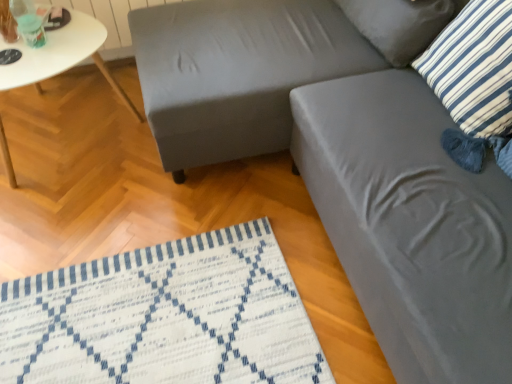
What do you see at coordinates (236, 72) in the screenshot? The width and height of the screenshot is (512, 384). I see `matte gray swivel chair at upper right, the first swivel chair positioned from the top` at bounding box center [236, 72].

The width and height of the screenshot is (512, 384). Find the location of `matte gray swivel chair at upper right, acting as the 2th swivel chair starting from the bottom`. matte gray swivel chair at upper right, acting as the 2th swivel chair starting from the bottom is located at coordinates (236, 72).

Identify the location of matte gray swivel chair at upper right, the first swivel chair positioned from the top. (236, 72).

Can you confirm if matte gray swivel chair at upper right, acting as the 2th swivel chair starting from the bottom, is shorter than blue and white striped pillow at upper right, acting as the first pillow starting from the front?

Incorrect, the height of matte gray swivel chair at upper right, acting as the 2th swivel chair starting from the bottom, does not fall short of that of blue and white striped pillow at upper right, acting as the first pillow starting from the front.

Is matte gray swivel chair at upper right, acting as the 2th swivel chair starting from the bottom, bigger than blue and white striped pillow at upper right, acting as the first pillow starting from the front?

Yes, matte gray swivel chair at upper right, acting as the 2th swivel chair starting from the bottom, is bigger than blue and white striped pillow at upper right, acting as the first pillow starting from the front.

Which of these two, matte gray swivel chair at upper right, acting as the 2th swivel chair starting from the bottom, or blue and white striped pillow at upper right, acting as the first pillow starting from the front, is thinner?

blue and white striped pillow at upper right, acting as the first pillow starting from the front.

How many degrees apart are the facing directions of matte gray swivel chair at upper right, acting as the 2th swivel chair starting from the bottom, and blue and white striped pillow at upper right, positioned as the second pillow in back-to-front order?

There is a 90-degree angle between the facing directions of matte gray swivel chair at upper right, acting as the 2th swivel chair starting from the bottom, and blue and white striped pillow at upper right, positioned as the second pillow in back-to-front order.

From the image's perspective, who appears lower, matte gray swivel chair at upper right, the first swivel chair positioned from the top, or matte gray swivel chair at center, acting as the second swivel chair starting from the top?

matte gray swivel chair at center, acting as the second swivel chair starting from the top, is shown below in the image.

From a real-world perspective, is matte gray swivel chair at upper right, acting as the 2th swivel chair starting from the bottom, over matte gray swivel chair at center, arranged as the 1th swivel chair when ordered from the bottom?

No, from a real-world perspective, matte gray swivel chair at upper right, acting as the 2th swivel chair starting from the bottom, is not above matte gray swivel chair at center, arranged as the 1th swivel chair when ordered from the bottom.

This screenshot has height=384, width=512. There is a matte gray swivel chair at upper right, the first swivel chair positioned from the top. In order to click on swivel chair above it (from a real-world perspective) in this screenshot , I will do [x=411, y=225].

Is matte gray swivel chair at upper right, acting as the 2th swivel chair starting from the bottom, taller or shorter than matte gray swivel chair at center, arranged as the 1th swivel chair when ordered from the bottom?

In the image, matte gray swivel chair at upper right, acting as the 2th swivel chair starting from the bottom, appears to be shorter than matte gray swivel chair at center, arranged as the 1th swivel chair when ordered from the bottom.

Is blue striped pillow at upper right, which is counted as the second pillow, starting from the front, beside white glossy table at left?

No, blue striped pillow at upper right, which is counted as the second pillow, starting from the front, is not in contact with white glossy table at left.

Locate an element on the screen. table below the blue striped pillow at upper right, which is counted as the second pillow, starting from the front (from the image's perspective) is located at coordinates (61, 57).

Looking at this image, looking at their sizes, would you say blue striped pillow at upper right, the 1th pillow viewed from the back, is wider or thinner than white glossy table at left?

Clearly, blue striped pillow at upper right, the 1th pillow viewed from the back, has less width compared to white glossy table at left.

Which of these two, blue striped pillow at upper right, which is counted as the second pillow, starting from the front, or white glossy table at left, is smaller?

blue striped pillow at upper right, which is counted as the second pillow, starting from the front.

Considering the relative positions of blue striped pillow at upper right, the 1th pillow viewed from the back, and blue and white striped pillow at upper right, positioned as the second pillow in back-to-front order, in the image provided, is blue striped pillow at upper right, the 1th pillow viewed from the back, to the left or to the right of blue and white striped pillow at upper right, positioned as the second pillow in back-to-front order,?

Clearly, blue striped pillow at upper right, the 1th pillow viewed from the back, is on the left of blue and white striped pillow at upper right, positioned as the second pillow in back-to-front order, in the image.

Considering the points (434, 26) and (511, 32), which point is in front, point (434, 26) or point (511, 32)?

The point (511, 32) is in front.

Which object is more forward, blue striped pillow at upper right, which is counted as the second pillow, starting from the front, or blue and white striped pillow at upper right, acting as the first pillow starting from the front?

blue and white striped pillow at upper right, acting as the first pillow starting from the front, is more forward.

Is blue striped pillow at upper right, which is counted as the second pillow, starting from the front, taller or shorter than blue and white striped pillow at upper right, acting as the first pillow starting from the front?

In the image, blue striped pillow at upper right, which is counted as the second pillow, starting from the front, appears to be shorter than blue and white striped pillow at upper right, acting as the first pillow starting from the front.

From a real-world perspective, relative to white glossy table at left, is blue and white striped pillow at upper right, acting as the first pillow starting from the front, vertically above or below?

blue and white striped pillow at upper right, acting as the first pillow starting from the front, is above white glossy table at left.

From the image's perspective, would you say blue and white striped pillow at upper right, acting as the first pillow starting from the front, is positioned over white glossy table at left?

No, from the image's perspective, blue and white striped pillow at upper right, acting as the first pillow starting from the front, is not above white glossy table at left.

Considering the relative sizes of blue and white striped pillow at upper right, positioned as the second pillow in back-to-front order, and white glossy table at left in the image provided, is blue and white striped pillow at upper right, positioned as the second pillow in back-to-front order, shorter than white glossy table at left?

Yes, blue and white striped pillow at upper right, positioned as the second pillow in back-to-front order, is shorter than white glossy table at left.

Is blue and white striped pillow at upper right, positioned as the second pillow in back-to-front order, turned away from white glossy table at left?

No, white glossy table at left is not at the back of blue and white striped pillow at upper right, positioned as the second pillow in back-to-front order.

From the image's perspective, is matte gray swivel chair at center, arranged as the 1th swivel chair when ordered from the bottom, under blue and white striped pillow at upper right, positioned as the second pillow in back-to-front order?

Indeed, from the image's perspective, matte gray swivel chair at center, arranged as the 1th swivel chair when ordered from the bottom, is shown beneath blue and white striped pillow at upper right, positioned as the second pillow in back-to-front order.

From the picture: From a real-world perspective, is matte gray swivel chair at center, acting as the second swivel chair starting from the top, physically above blue and white striped pillow at upper right, acting as the first pillow starting from the front?

No, from a real-world perspective, matte gray swivel chair at center, acting as the second swivel chair starting from the top, is not on top of blue and white striped pillow at upper right, acting as the first pillow starting from the front.

Can you tell me how much matte gray swivel chair at center, arranged as the 1th swivel chair when ordered from the bottom, and blue and white striped pillow at upper right, acting as the first pillow starting from the front, differ in facing direction?

The angular difference between matte gray swivel chair at center, arranged as the 1th swivel chair when ordered from the bottom, and blue and white striped pillow at upper right, acting as the first pillow starting from the front, is 0.306 degrees.

From the blue and white striped pillow at upper right, positioned as the second pillow in back-to-front order, count the 1st swivel chair to the left and point to it. Please provide its 2D coordinates.

[(411, 225)]

Is white glossy table at left oriented towards blue and white striped pillow at upper right, positioned as the second pillow in back-to-front order?

No, white glossy table at left is not facing towards blue and white striped pillow at upper right, positioned as the second pillow in back-to-front order.

From a real-world perspective, does white glossy table at left stand above blue and white striped pillow at upper right, positioned as the second pillow in back-to-front order?

No.

Which of these two, white glossy table at left or blue and white striped pillow at upper right, acting as the first pillow starting from the front, stands shorter?

blue and white striped pillow at upper right, acting as the first pillow starting from the front, is shorter.

In the scene shown: Is white glossy table at left in contact with blue and white striped pillow at upper right, positioned as the second pillow in back-to-front order?

No, white glossy table at left is not making contact with blue and white striped pillow at upper right, positioned as the second pillow in back-to-front order.

Where is `the 2nd pillow to the right when counting from the matte gray swivel chair at upper right, the first swivel chair positioned from the top`? Image resolution: width=512 pixels, height=384 pixels. the 2nd pillow to the right when counting from the matte gray swivel chair at upper right, the first swivel chair positioned from the top is located at coordinates (474, 68).

Find the location of a particular element. The image size is (512, 384). swivel chair above the matte gray swivel chair at upper right, the first swivel chair positioned from the top (from a real-world perspective) is located at coordinates (411, 225).

Which object lies nearer to the anchor point matte gray swivel chair at upper right, the first swivel chair positioned from the top, matte gray swivel chair at center, acting as the second swivel chair starting from the top, or blue striped pillow at upper right, which is counted as the second pillow, starting from the front?

The object closer to matte gray swivel chair at upper right, the first swivel chair positioned from the top, is blue striped pillow at upper right, which is counted as the second pillow, starting from the front.

Which object lies further to the anchor point matte gray swivel chair at center, acting as the second swivel chair starting from the top, white glossy table at left or blue and white striped pillow at upper right, acting as the first pillow starting from the front?

The object further to matte gray swivel chair at center, acting as the second swivel chair starting from the top, is white glossy table at left.

Estimate the real-world distances between objects in this image. Which object is closer to white glossy table at left, blue and white striped pillow at upper right, acting as the first pillow starting from the front, or matte gray swivel chair at center, arranged as the 1th swivel chair when ordered from the bottom?

matte gray swivel chair at center, arranged as the 1th swivel chair when ordered from the bottom, is closer to white glossy table at left.

When comparing their distances from blue striped pillow at upper right, which is counted as the second pillow, starting from the front, does matte gray swivel chair at upper right, the first swivel chair positioned from the top, or matte gray swivel chair at center, arranged as the 1th swivel chair when ordered from the bottom, seem closer?

matte gray swivel chair at upper right, the first swivel chair positioned from the top, is positioned closer to the anchor blue striped pillow at upper right, which is counted as the second pillow, starting from the front.

Which object lies further to the anchor point matte gray swivel chair at center, arranged as the 1th swivel chair when ordered from the bottom, white glossy table at left or matte gray swivel chair at upper right, acting as the 2th swivel chair starting from the bottom?

white glossy table at left.

Considering their positions, is matte gray swivel chair at center, arranged as the 1th swivel chair when ordered from the bottom, positioned further to blue striped pillow at upper right, which is counted as the second pillow, starting from the front, than matte gray swivel chair at upper right, the first swivel chair positioned from the top?

matte gray swivel chair at center, arranged as the 1th swivel chair when ordered from the bottom.

When comparing their distances from white glossy table at left, does matte gray swivel chair at center, acting as the second swivel chair starting from the top, or blue and white striped pillow at upper right, acting as the first pillow starting from the front, seem closer?

Among the two, matte gray swivel chair at center, acting as the second swivel chair starting from the top, is located nearer to white glossy table at left.

When comparing their distances from matte gray swivel chair at center, acting as the second swivel chair starting from the top, does white glossy table at left or blue striped pillow at upper right, which is counted as the second pillow, starting from the front, seem closer?

Among the two, blue striped pillow at upper right, which is counted as the second pillow, starting from the front, is located nearer to matte gray swivel chair at center, acting as the second swivel chair starting from the top.

This screenshot has height=384, width=512. I want to click on swivel chair between matte gray swivel chair at center, acting as the second swivel chair starting from the top, and blue striped pillow at upper right, which is counted as the second pillow, starting from the front, in the front-back direction, so click(x=236, y=72).

Where is `swivel chair between white glossy table at left and matte gray swivel chair at center, acting as the second swivel chair starting from the top, in the horizontal direction`? Image resolution: width=512 pixels, height=384 pixels. swivel chair between white glossy table at left and matte gray swivel chair at center, acting as the second swivel chair starting from the top, in the horizontal direction is located at coordinates (236, 72).

Find the location of a particular element. The image size is (512, 384). pillow between white glossy table at left and matte gray swivel chair at center, acting as the second swivel chair starting from the top, from left to right is located at coordinates (399, 25).

Locate an element on the screen. This screenshot has height=384, width=512. pillow located between matte gray swivel chair at center, acting as the second swivel chair starting from the top, and blue striped pillow at upper right, which is counted as the second pillow, starting from the front, in the depth direction is located at coordinates (474, 68).